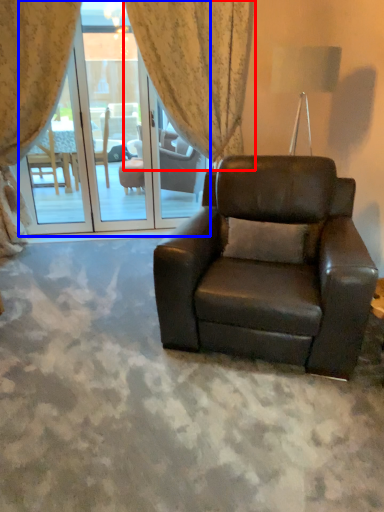
Question: Which object is closer to the camera taking this photo, curtain (highlighted by a red box) or screen door (highlighted by a blue box)?

Choices:
 (A) curtain
 (B) screen door

Answer: (A)